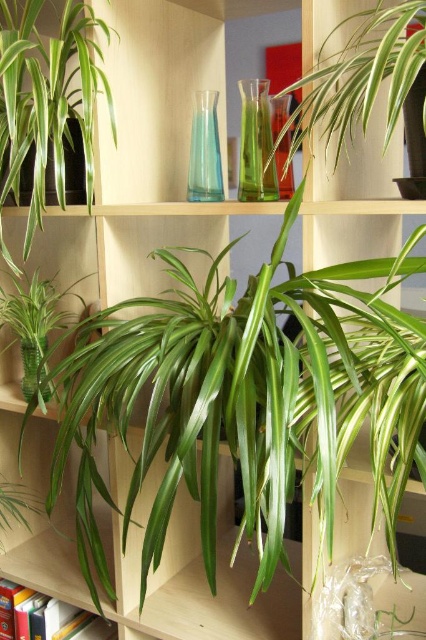
Can you confirm if green leafy plant at upper right is taller than transparent glass vase at center?

Yes, green leafy plant at upper right is taller than transparent glass vase at center.

Who is higher up, green leafy plant at upper right or transparent glass vase at center?

Positioned higher is green leafy plant at upper right.

Identify the location of green leafy plant at upper right. The width and height of the screenshot is (426, 640). (360, 74).

Where is `green leafy plant at upper right`? The image size is (426, 640). green leafy plant at upper right is located at coordinates (360, 74).

Consider the image. Is green glass vase at center shorter than transparent glass vase at center?

In fact, green glass vase at center may be taller than transparent glass vase at center.

Between point (265, 161) and point (192, 170), which one is positioned behind?

The point (192, 170) is more distant.

You are a GUI agent. You are given a task and a screenshot of the screen. Output one action in this format:
    pyautogui.click(x=<x>, y=<y>)
    Task: Click on the green glass vase at center
    The height and width of the screenshot is (640, 426).
    Given the screenshot: What is the action you would take?
    pyautogui.click(x=256, y=144)

Does green glossy plant at center appear over transparent glass vase at lower left?

Indeed, green glossy plant at center is positioned over transparent glass vase at lower left.

Does green glossy plant at center appear on the right side of transparent glass vase at lower left?

No, green glossy plant at center is not to the right of transparent glass vase at lower left.

Is point (54, 304) behind point (32, 340)?

Yes, it is.

At what (x,y) coordinates should I click in order to perform the action: click on green glossy plant at center. Please return your answer as a coordinate pair (x, y). The width and height of the screenshot is (426, 640). Looking at the image, I should click on (36, 326).